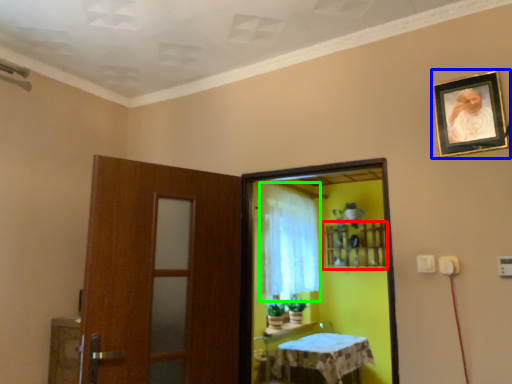
Question: Considering the real-world distances, which object is closest to shelf (highlighted by a red box)? picture frame (highlighted by a blue box) or curtain (highlighted by a green box).

Choices:
 (A) picture frame
 (B) curtain

Answer: (B)